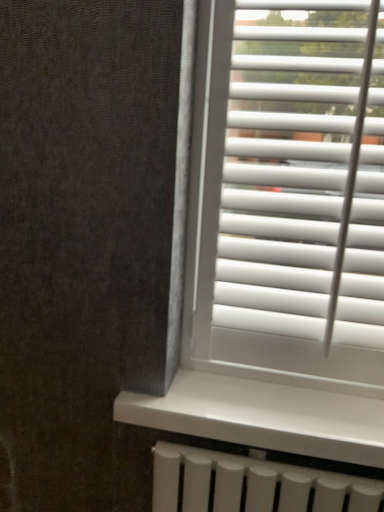
Question: Is white plastic blinds at right to the left of white smooth window sill at center from the viewer's perspective?

Choices:
 (A) yes
 (B) no

Answer: (B)

Question: Does white plastic blinds at right come in front of white smooth window sill at center?

Choices:
 (A) yes
 (B) no

Answer: (A)

Question: Considering the relative sizes of white plastic blinds at right and white smooth window sill at center in the image provided, is white plastic blinds at right thinner than white smooth window sill at center?

Choices:
 (A) yes
 (B) no

Answer: (A)

Question: Is white plastic blinds at right beside white smooth window sill at center?

Choices:
 (A) no
 (B) yes

Answer: (A)

Question: Does white plastic blinds at right have a greater width compared to white smooth window sill at center?

Choices:
 (A) yes
 (B) no

Answer: (B)

Question: Does white plastic blinds at right have a lesser height compared to white smooth window sill at center?

Choices:
 (A) no
 (B) yes

Answer: (A)

Question: Is white plastic blinds at right located within white smooth window sill at center?

Choices:
 (A) yes
 (B) no

Answer: (B)

Question: Is white smooth window sill at center looking in the opposite direction of white plastic blinds at right?

Choices:
 (A) no
 (B) yes

Answer: (A)

Question: Does white smooth window sill at center have a lesser width compared to white plastic blinds at right?

Choices:
 (A) yes
 (B) no

Answer: (B)

Question: Is white smooth window sill at center at the left side of white plastic blinds at right?

Choices:
 (A) no
 (B) yes

Answer: (B)

Question: Can you confirm if white smooth window sill at center is wider than white plastic blinds at right?

Choices:
 (A) no
 (B) yes

Answer: (B)

Question: From the image's perspective, is white smooth window sill at center beneath white plastic blinds at right?

Choices:
 (A) no
 (B) yes

Answer: (B)

Question: From a real-world perspective, is white smooth window sill at center physically located above or below white plastic blinds at right?

Choices:
 (A) below
 (B) above

Answer: (A)